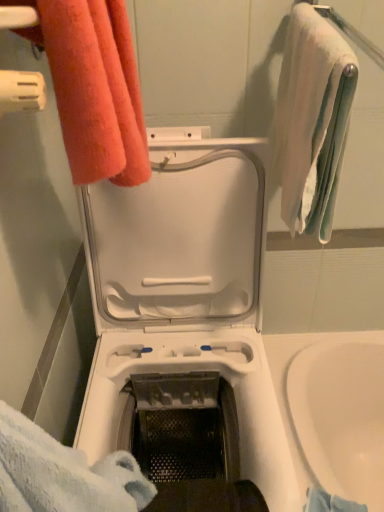
Question: Is white soft towel at upper right, which is counted as the 1th towel, starting from the right, completely or partially outside of white plastic washing machine at center?

Choices:
 (A) yes
 (B) no

Answer: (A)

Question: Does white soft towel at upper right, arranged as the second towel when viewed from the left, appear on the left side of white plastic washing machine at center?

Choices:
 (A) yes
 (B) no

Answer: (B)

Question: From the image's perspective, is white soft towel at upper right, arranged as the second towel when viewed from the left, located above white plastic washing machine at center?

Choices:
 (A) no
 (B) yes

Answer: (B)

Question: Are white soft towel at upper right, arranged as the second towel when viewed from the left, and white plastic washing machine at center located far from each other?

Choices:
 (A) no
 (B) yes

Answer: (A)

Question: Is white soft towel at upper right, arranged as the second towel when viewed from the left, wider than white plastic washing machine at center?

Choices:
 (A) no
 (B) yes

Answer: (A)

Question: Would you say white soft towel at upper right, which is counted as the 1th towel, starting from the right, contains white plastic washing machine at center?

Choices:
 (A) yes
 (B) no

Answer: (B)

Question: Is orange terry cloth towel at upper left, positioned as the 1th towel in left-to-right order, bigger than white soft towel at upper right, arranged as the second towel when viewed from the left?

Choices:
 (A) no
 (B) yes

Answer: (A)

Question: Is orange terry cloth towel at upper left, positioned as the 1th towel in left-to-right order, at the right side of white soft towel at upper right, arranged as the second towel when viewed from the left?

Choices:
 (A) yes
 (B) no

Answer: (B)

Question: Can you confirm if orange terry cloth towel at upper left, positioned as the 1th towel in left-to-right order, is shorter than white soft towel at upper right, which is counted as the 1th towel, starting from the right?

Choices:
 (A) no
 (B) yes

Answer: (B)

Question: Does orange terry cloth towel at upper left, positioned as the 1th towel in left-to-right order, turn towards white soft towel at upper right, which is counted as the 1th towel, starting from the right?

Choices:
 (A) no
 (B) yes

Answer: (B)

Question: Considering the relative positions of orange terry cloth towel at upper left, the second towel in the right-to-left sequence, and white soft towel at upper right, arranged as the second towel when viewed from the left, in the image provided, is orange terry cloth towel at upper left, the second towel in the right-to-left sequence, to the left of white soft towel at upper right, arranged as the second towel when viewed from the left, from the viewer's perspective?

Choices:
 (A) yes
 (B) no

Answer: (A)

Question: Considering the relative sizes of orange terry cloth towel at upper left, positioned as the 1th towel in left-to-right order, and white soft towel at upper right, which is counted as the 1th towel, starting from the right, in the image provided, is orange terry cloth towel at upper left, positioned as the 1th towel in left-to-right order, wider than white soft towel at upper right, which is counted as the 1th towel, starting from the right,?

Choices:
 (A) no
 (B) yes

Answer: (A)

Question: Considering the relative positions of white soft towel at upper right, which is counted as the 1th towel, starting from the right, and orange terry cloth towel at upper left, the second towel in the right-to-left sequence, in the image provided, is white soft towel at upper right, which is counted as the 1th towel, starting from the right, to the left of orange terry cloth towel at upper left, the second towel in the right-to-left sequence, from the viewer's perspective?

Choices:
 (A) no
 (B) yes

Answer: (A)